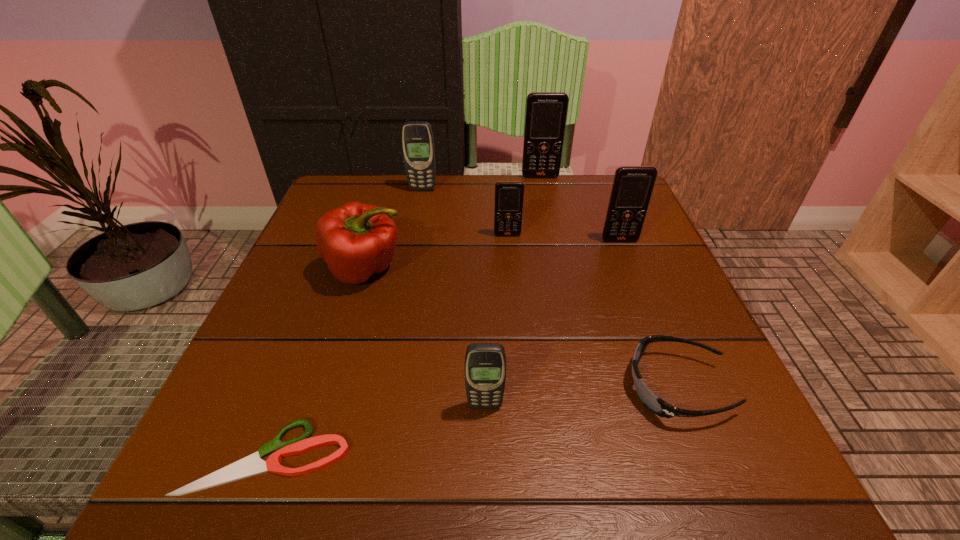
I want to click on the smaller gray cellular telephone, so click(485, 363).

In order to click on the nearest cellular telephone in this screenshot , I will do `click(485, 363)`.

Where is `sunglasses`? sunglasses is located at coordinates (655, 404).

You are a GUI agent. You are given a task and a screenshot of the screen. Output one action in this format:
    pyautogui.click(x=<x>, y=<y>)
    Task: Click on the scissors
    The width and height of the screenshot is (960, 540).
    Given the screenshot: What is the action you would take?
    pyautogui.click(x=252, y=465)

Where is `green scissors`? The width and height of the screenshot is (960, 540). green scissors is located at coordinates (252, 465).

The height and width of the screenshot is (540, 960). What are the coordinates of `blank space located 0.250m on the screen of the farthest object` in the screenshot? It's located at (552, 233).

Image resolution: width=960 pixels, height=540 pixels. Find the location of `vacant position located on the screen of the leftmost cellular telephone`. vacant position located on the screen of the leftmost cellular telephone is located at coordinates (x=420, y=202).

Find the location of a particular element. vacant area situated on the screen of the rightmost cellular telephone is located at coordinates (660, 340).

Find the location of a particular element. The width and height of the screenshot is (960, 540). vacant space located 0.370m on the front of the pink bell pepper is located at coordinates (299, 495).

Identify the location of free space located on the screen of the sixth nearest object. This screenshot has height=540, width=960. (518, 377).